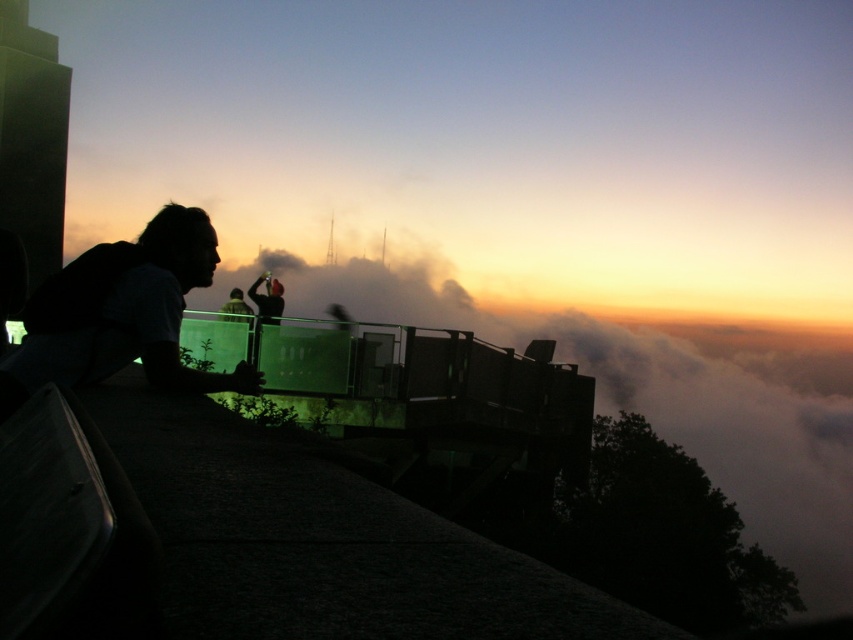
You are standing at the viewpoint and want to take a photo of the dark hair at left and the dark fabric jacket at center. Which object should you focus on first to ensure both are in sharp focus?

You should focus on the dark hair at left first because it is closer to you than the dark fabric jacket at center, ensuring both will be in focus when using a camera with proper depth of field settings.

You are standing at the viewpoint and notice two people in the scene. One has dark hair at left and the other is wearing a dark fabric jacket at center. Which of these two individuals is shorter?

The dark hair at left is not as tall as the dark fabric jacket at center, so the person with dark hair at left is shorter.

You are standing at the viewpoint and want to take a photo of the dark hair at left and dark fabric jacket at center. Which object should you focus on first if you want both to be in the same frame?

You should focus on the dark fabric jacket at center first because it is above the dark hair at left, so adjusting the camera to include both would require framing from the higher object downward.